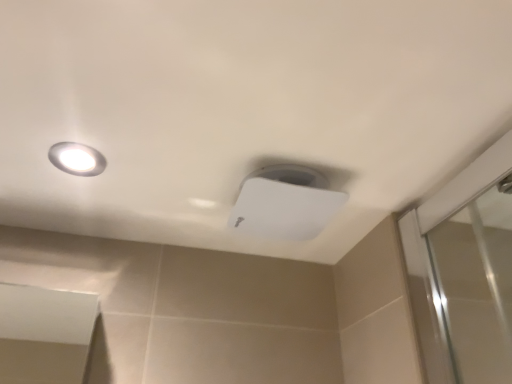
Question: Is matte white droplight at upper left to the left or to the right of white plastic lamp at upper center in the image?

Choices:
 (A) left
 (B) right

Answer: (A)

Question: Based on their sizes in the image, would you say matte white droplight at upper left is bigger or smaller than white plastic lamp at upper center?

Choices:
 (A) small
 (B) big

Answer: (A)

Question: Considering the positions of matte white droplight at upper left and white plastic lamp at upper center in the image, is matte white droplight at upper left wider or thinner than white plastic lamp at upper center?

Choices:
 (A) wide
 (B) thin

Answer: (B)

Question: In terms of height, does white plastic lamp at upper center look taller or shorter compared to matte white droplight at upper left?

Choices:
 (A) tall
 (B) short

Answer: (A)

Question: Is white plastic lamp at upper center situated inside matte white droplight at upper left or outside?

Choices:
 (A) outside
 (B) inside

Answer: (A)

Question: From a real-world perspective, relative to matte white droplight at upper left, is white plastic lamp at upper center vertically above or below?

Choices:
 (A) below
 (B) above

Answer: (A)

Question: Is point (286, 168) positioned closer to the camera than point (96, 168)?

Choices:
 (A) closer
 (B) farther

Answer: (A)